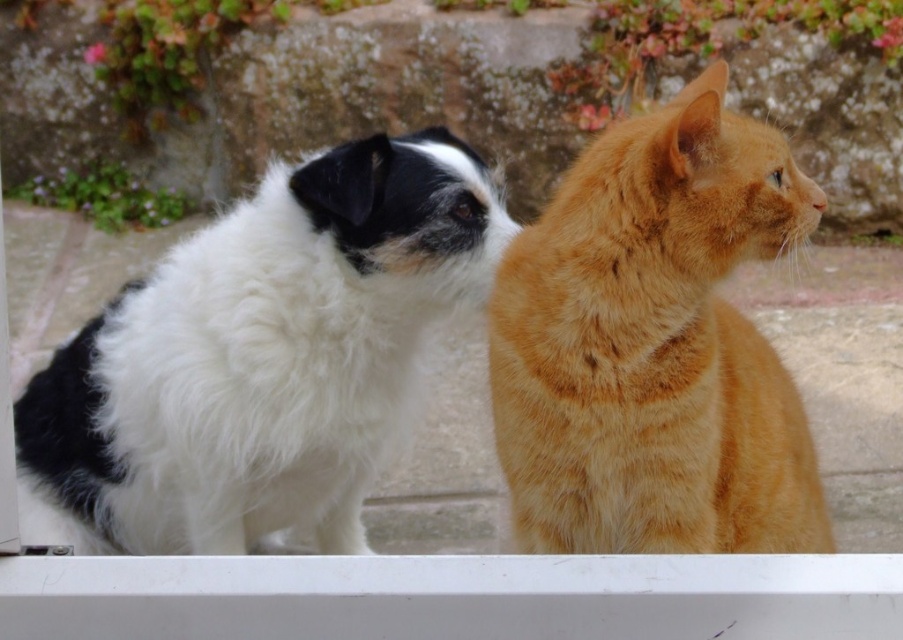
Looking at this image, can you confirm if white fluffy dog at left is bigger than orange fur cat at right?

Indeed, white fluffy dog at left has a larger size compared to orange fur cat at right.

Does white fluffy dog at left have a greater height compared to orange fur cat at right?

Correct, white fluffy dog at left is much taller as orange fur cat at right.

Which is in front, point (375, 204) or point (767, 150)?

Point (767, 150)

Identify the location of white fluffy dog at left. (259, 358).